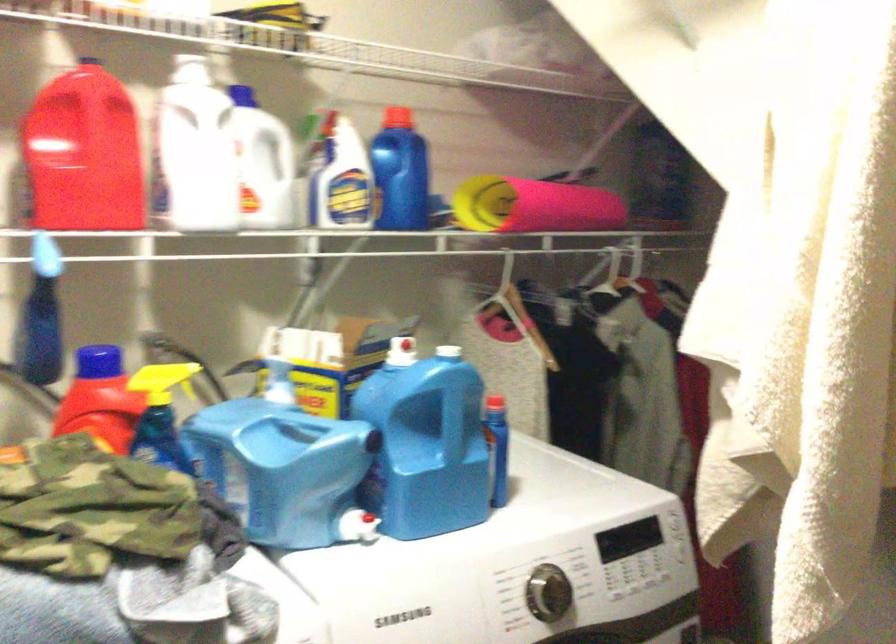
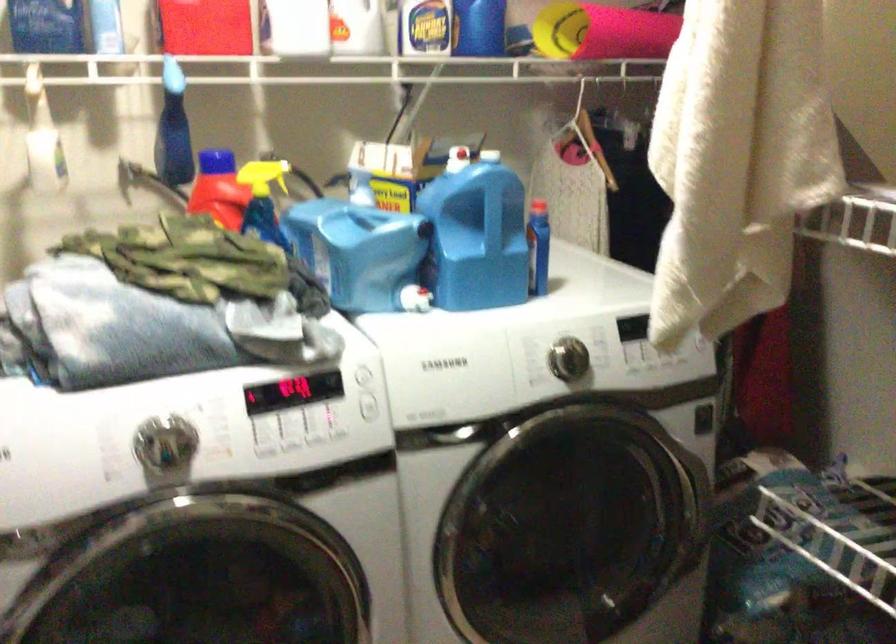
Find the pixel in the second image that matches point (458, 426) in the first image.

(496, 219)